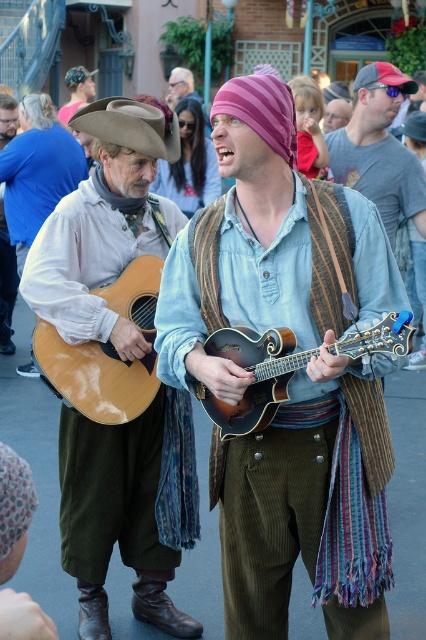
Which is behind, point (135, 515) or point (264, 416)?

Positioned behind is point (135, 515).

Is matte brown guitar at left bigger than wooden mandolin at center?

Correct, matte brown guitar at left is larger in size than wooden mandolin at center.

Does point (71, 230) lie in front of point (227, 349)?

No, (71, 230) is further to viewer.

Where is `matte brown guitar at left`? matte brown guitar at left is located at coordinates (129, 508).

Does striped fabric mandolin at center have a greater height compared to brown felt cowboy hat at upper left?

Correct, striped fabric mandolin at center is much taller as brown felt cowboy hat at upper left.

Does striped fabric mandolin at center appear on the left side of brown felt cowboy hat at upper left?

Incorrect, striped fabric mandolin at center is not on the left side of brown felt cowboy hat at upper left.

Describe the element at coordinates (293, 376) in the screenshot. I see `striped fabric mandolin at center` at that location.

Identify the location of striped fabric mandolin at center. (293, 376).

Based on the photo, can you confirm if matte brown guitar at left is thinner than brown felt cowboy hat at upper left?

No, matte brown guitar at left is not thinner than brown felt cowboy hat at upper left.

Can you confirm if matte brown guitar at left is smaller than brown felt cowboy hat at upper left?

Actually, matte brown guitar at left might be larger than brown felt cowboy hat at upper left.

Identify the location of matte brown guitar at left. (129, 508).

You are a GUI agent. You are given a task and a screenshot of the screen. Output one action in this format:
    pyautogui.click(x=<x>, y=<y>)
    Task: Click on the matte brown guitar at left
    The image size is (426, 640).
    Given the screenshot: What is the action you would take?
    pyautogui.click(x=129, y=508)